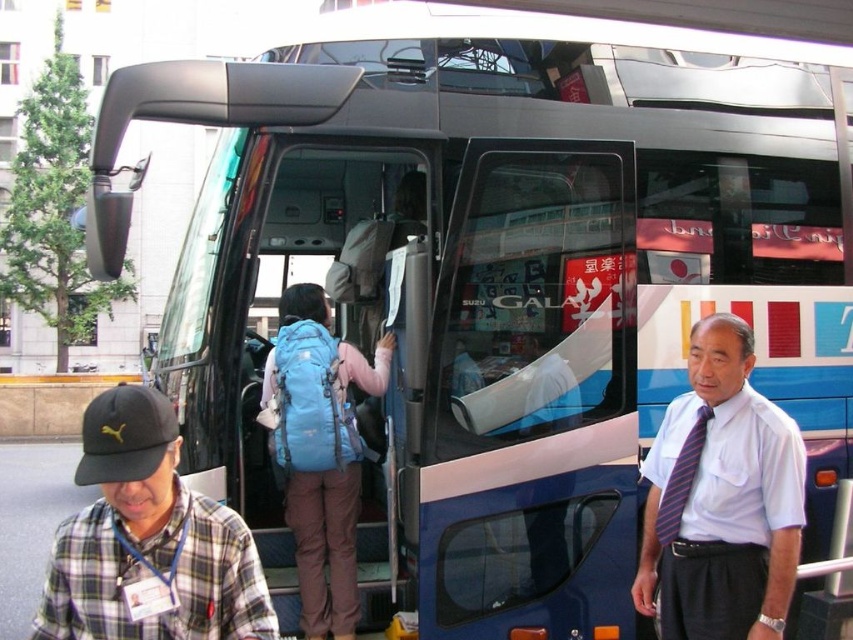
Question: Can you confirm if plaid shirt at lower left is positioned to the right of striped fabric tie at right?

Choices:
 (A) yes
 (B) no

Answer: (B)

Question: Can you confirm if plaid shirt at lower left is positioned above striped fabric tie at right?

Choices:
 (A) no
 (B) yes

Answer: (A)

Question: Does white shirt with tie at center have a smaller size compared to blue fabric backpack at center?

Choices:
 (A) yes
 (B) no

Answer: (A)

Question: Which point appears closest to the camera in this image?

Choices:
 (A) (161, 561)
 (B) (683, 440)
 (C) (381, 356)

Answer: (A)

Question: Among these objects, which one is nearest to the camera?

Choices:
 (A) striped fabric tie at right
 (B) white shirt with tie at center
 (C) plaid shirt at lower left

Answer: (C)

Question: Which of the following is the farthest from the observer?

Choices:
 (A) (761, 518)
 (B) (309, 397)

Answer: (B)